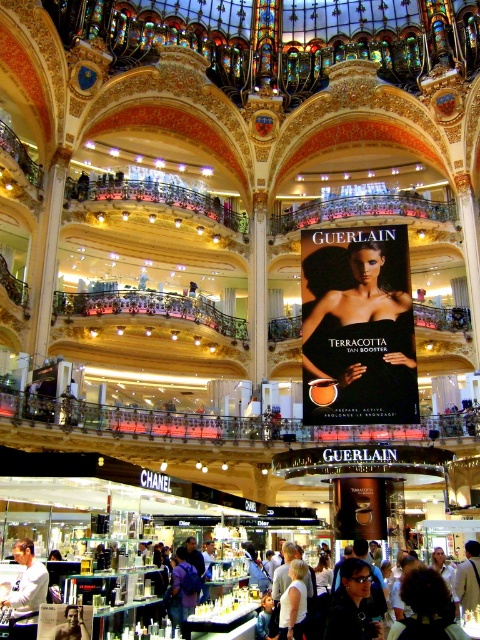
Does matte black compact at center have a lesser height compared to white cotton shirt at center?

Incorrect, matte black compact at center's height does not fall short of white cotton shirt at center's.

Can you confirm if matte black compact at center is thinner than white cotton shirt at center?

No, matte black compact at center is not thinner than white cotton shirt at center.

Is point (398, 305) more distant than point (21, 620)?

Yes, point (398, 305) is farther from viewer.

Find the location of `matte black compact at center`. matte black compact at center is located at coordinates (358, 326).

Which is below, matte black compact at center or purple fabric backpack at center?

Positioned lower is purple fabric backpack at center.

Between matte black compact at center and purple fabric backpack at center, which one has less height?

purple fabric backpack at center is shorter.

Where is `matte black compact at center`? matte black compact at center is located at coordinates (358, 326).

Between matte black compact at center and dark sunglasses at center, which one appears on the left side from the viewer's perspective?

Positioned to the left is dark sunglasses at center.

Describe the element at coordinates (358, 326) in the screenshot. I see `matte black compact at center` at that location.

The image size is (480, 640). What are the coordinates of `matte black compact at center` in the screenshot? It's located at (358, 326).

What are the coordinates of `matte black compact at center` in the screenshot? It's located at 358,326.